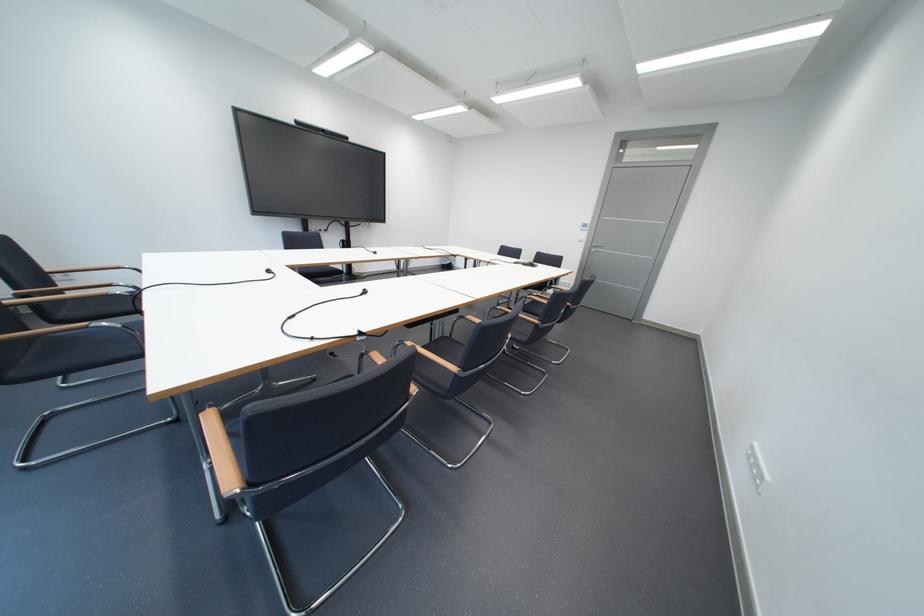
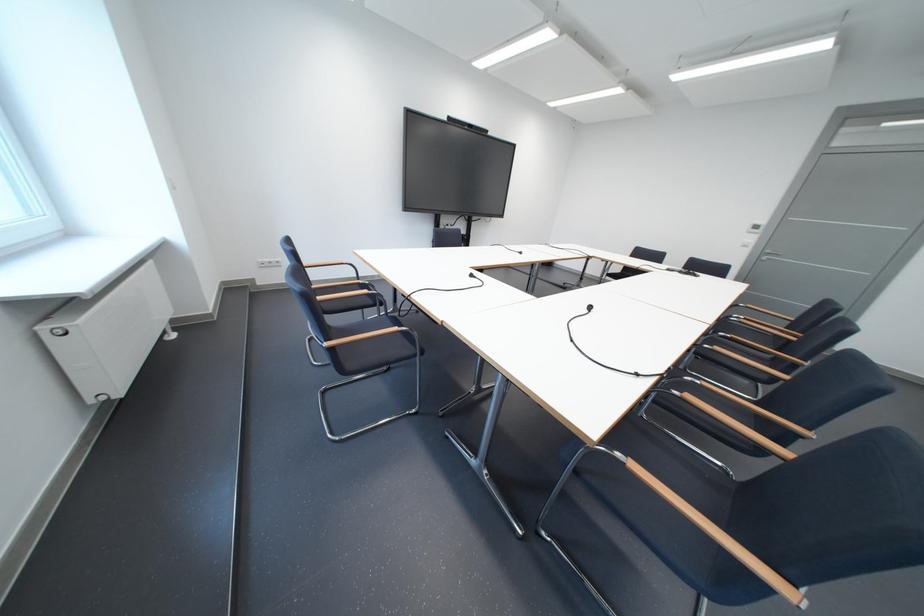
Question: The images are taken continuously from a first-person perspective. In which direction are you moving?

Choices:
 (A) Left
 (B) Right
 (C) Forward
 (D) Backward

Answer: (A)